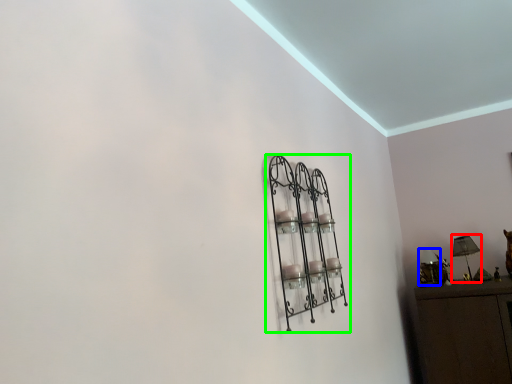
Question: Which object is positioned farthest from table lamp (highlighted by a red box)? Select from lamp (highlighted by a blue box) and shelf (highlighted by a green box).

Choices:
 (A) lamp
 (B) shelf

Answer: (B)